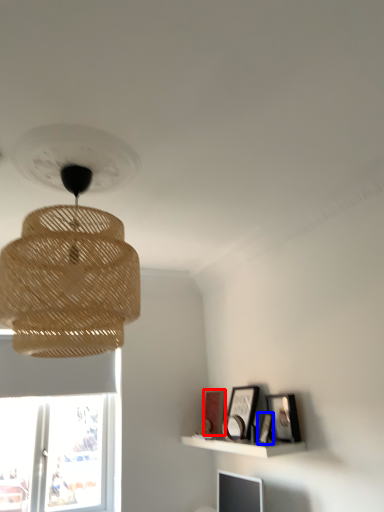
Question: Which object is closer to the camera taking this photo, picture frame (highlighted by a red box) or picture frame (highlighted by a blue box)?

Choices:
 (A) picture frame
 (B) picture frame

Answer: (B)